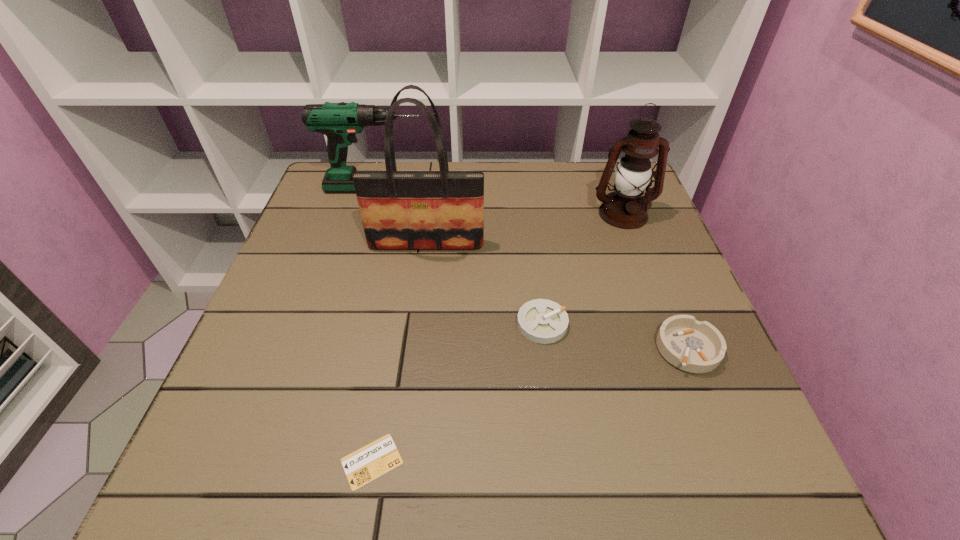
Locate an element on the screen. This screenshot has width=960, height=540. object that is positioned at the near edge is located at coordinates (370, 462).

Find the location of `object that is at the left edge`. object that is at the left edge is located at coordinates (340, 122).

This screenshot has width=960, height=540. Find the location of `lantern located at the right edge`. lantern located at the right edge is located at coordinates (625, 208).

You are a GUI agent. You are given a task and a screenshot of the screen. Output one action in this format:
    pyautogui.click(x=<x>, y=<y>)
    Task: Click on the ashtray that is at the right edge
    The image size is (960, 540).
    Given the screenshot: What is the action you would take?
    pyautogui.click(x=698, y=347)

At what (x,y) coordinates should I click in order to perform the action: click on object situated at the far left corner. Please return your answer as a coordinate pair (x, y). This screenshot has height=540, width=960. Looking at the image, I should click on (340, 122).

The image size is (960, 540). In order to click on object present at the far right corner in this screenshot , I will do [625, 208].

The height and width of the screenshot is (540, 960). Identify the location of vacant region at the far edge of the desktop. pyautogui.click(x=551, y=164).

Find the location of a particular element. Image resolution: width=960 pixels, height=540 pixels. vacant space at the left edge of the desktop is located at coordinates (356, 224).

Locate an element on the screen. vacant space at the right edge is located at coordinates (683, 401).

This screenshot has width=960, height=540. In the image, there is a desktop. What are the coordinates of `free space at the far left corner` in the screenshot? It's located at (356, 199).